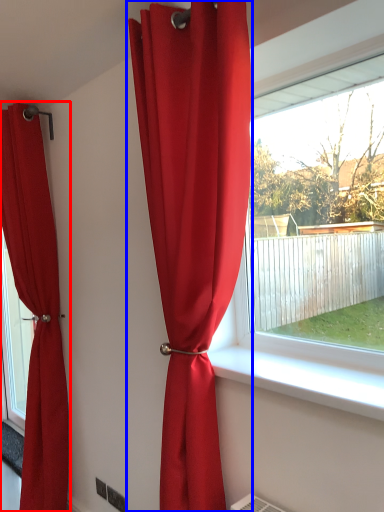
Question: Which of the following is the closest to the observer, curtain (highlighted by a red box) or curtain (highlighted by a blue box)?

Choices:
 (A) curtain
 (B) curtain

Answer: (B)